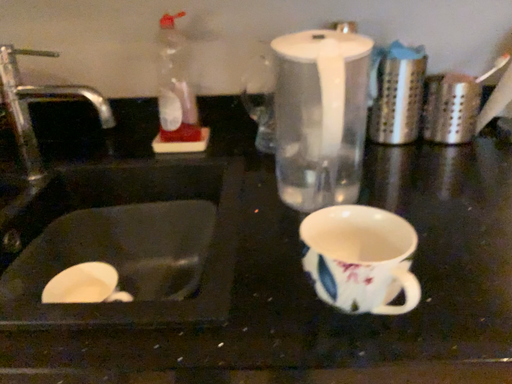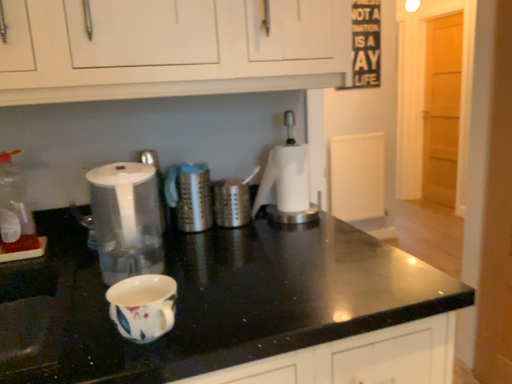
Question: How did the camera likely rotate when shooting the video?

Choices:
 (A) rotated upward
 (B) rotated downward

Answer: (A)